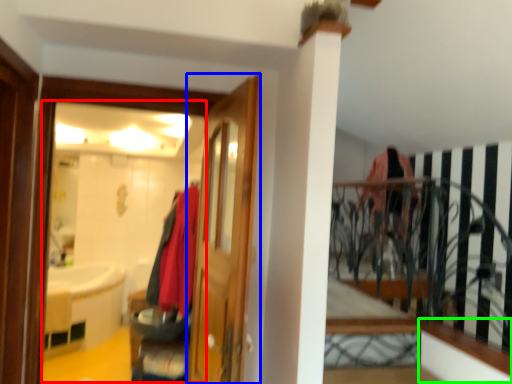
Question: Considering the real-world distances, which object is farthest from mirror (highlighted by a red box)? door (highlighted by a blue box) or ledge (highlighted by a green box)?

Choices:
 (A) door
 (B) ledge

Answer: (B)